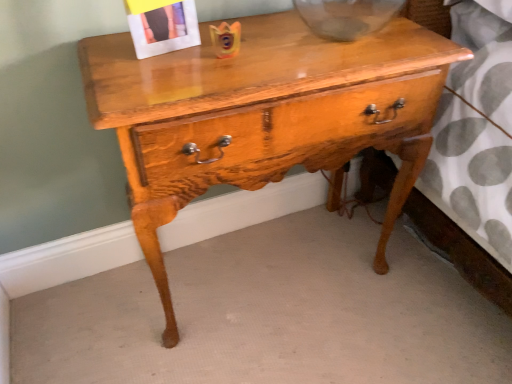
Locate an element on the screen. The image size is (512, 384). vacant area that is in front of glossy wood nightstand at center is located at coordinates (284, 350).